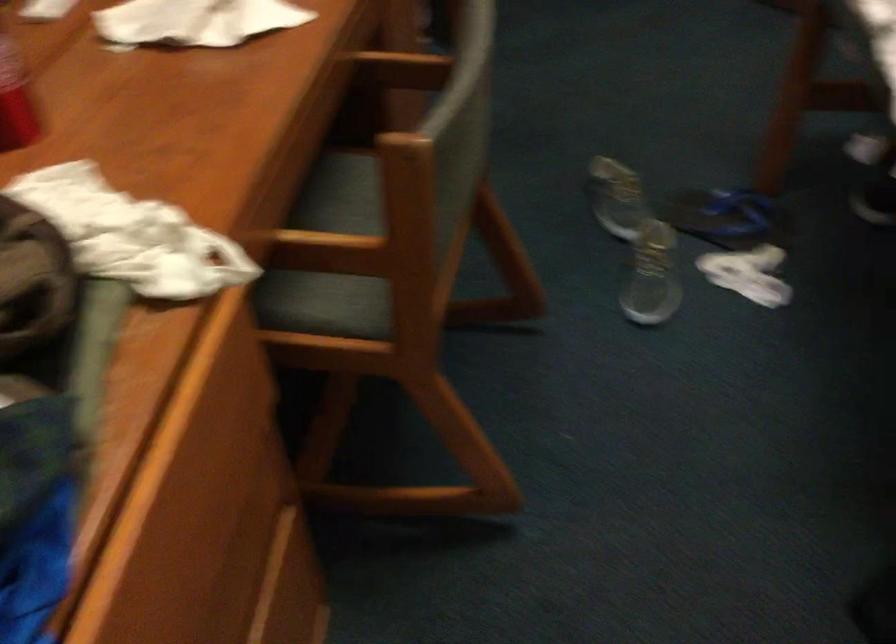
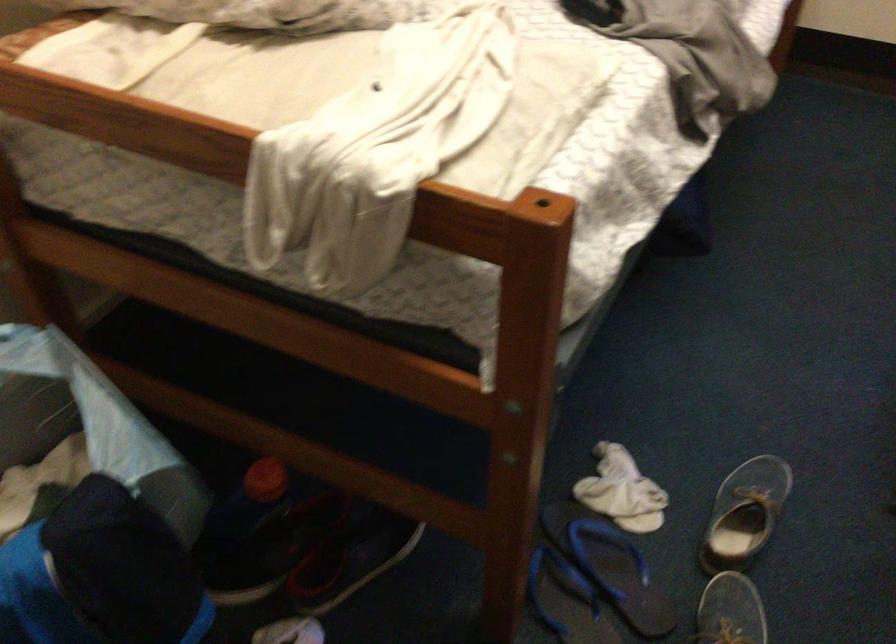
Find the pixel in the second image that matches (729,212) in the first image.

(566, 600)